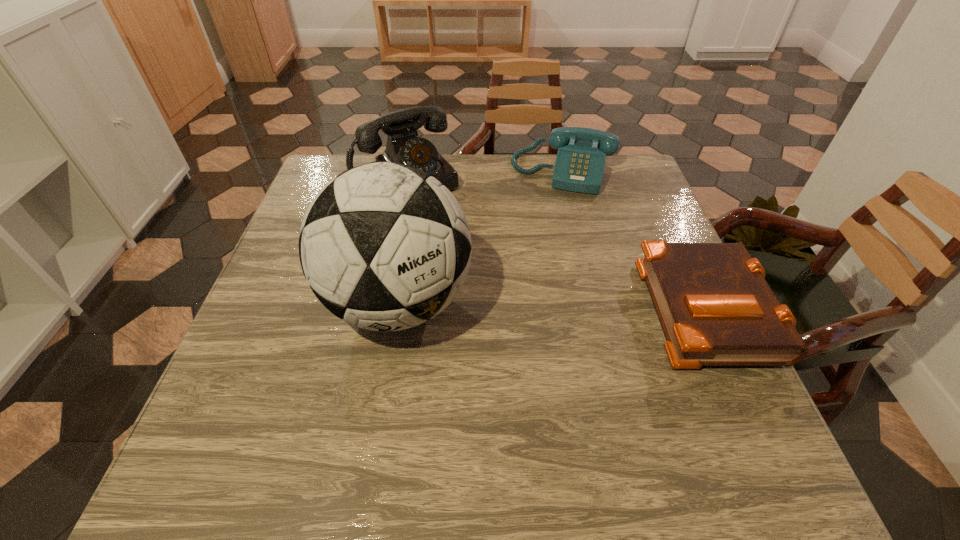
Where is `vacant space located 0.260m on the dial of the left telephone`? vacant space located 0.260m on the dial of the left telephone is located at coordinates (480, 261).

Locate an element on the screen. The width and height of the screenshot is (960, 540). vacant point located 0.130m on the dial of the left telephone is located at coordinates (453, 231).

Locate an element on the screen. vacant space located 0.160m on the dial of the left telephone is located at coordinates (459, 237).

Find the location of a particular element. soccer ball that is positioned at the left edge is located at coordinates (386, 247).

Locate an element on the screen. The width and height of the screenshot is (960, 540). telephone that is at the left edge is located at coordinates (404, 146).

You are a GUI agent. You are given a task and a screenshot of the screen. Output one action in this format:
    pyautogui.click(x=<x>, y=<y>)
    Task: Click on the Bible positioned at the right edge
    
    Given the screenshot: What is the action you would take?
    (714, 305)

Identify the location of telephone present at the right edge. The width and height of the screenshot is (960, 540). (580, 161).

At what (x,y) coordinates should I click in order to perform the action: click on object that is at the far left corner. Please return your answer as a coordinate pair (x, y). Image resolution: width=960 pixels, height=540 pixels. Looking at the image, I should click on (404, 146).

The width and height of the screenshot is (960, 540). I want to click on object at the far right corner, so click(580, 161).

The height and width of the screenshot is (540, 960). Find the location of `free space at the far edge`. free space at the far edge is located at coordinates (507, 193).